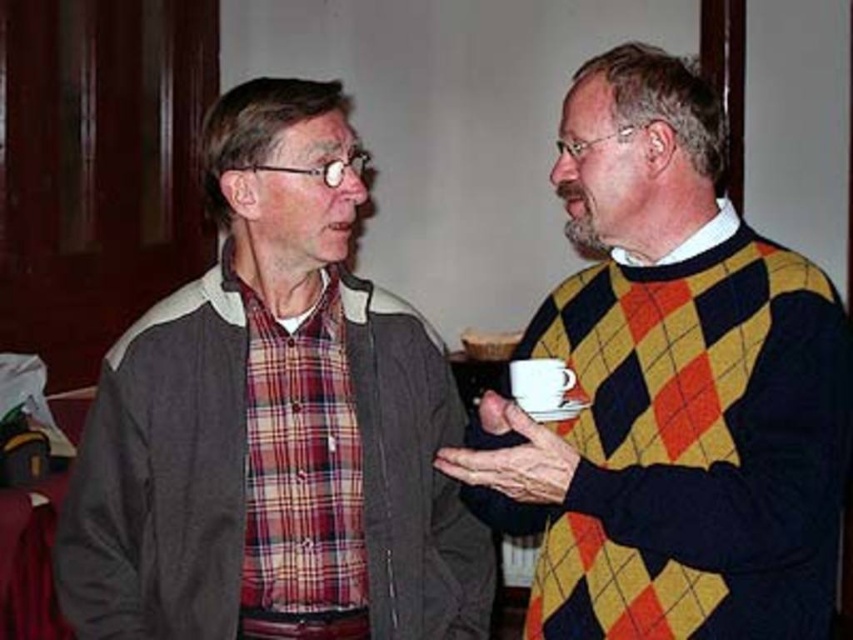
Question: Does plaid fabric shirt at center have a greater width compared to yellow argyle sweater at right?

Choices:
 (A) no
 (B) yes

Answer: (B)

Question: Is plaid fabric shirt at center positioned behind yellow argyle sweater at right?

Choices:
 (A) no
 (B) yes

Answer: (B)

Question: Is plaid fabric shirt at center below yellow argyle sweater at right?

Choices:
 (A) no
 (B) yes

Answer: (B)

Question: Which of the following is the closest to the observer?

Choices:
 (A) (480, 596)
 (B) (838, 369)

Answer: (B)

Question: Which point appears farthest from the camera in this image?

Choices:
 (A) (399, 630)
 (B) (802, 419)

Answer: (A)